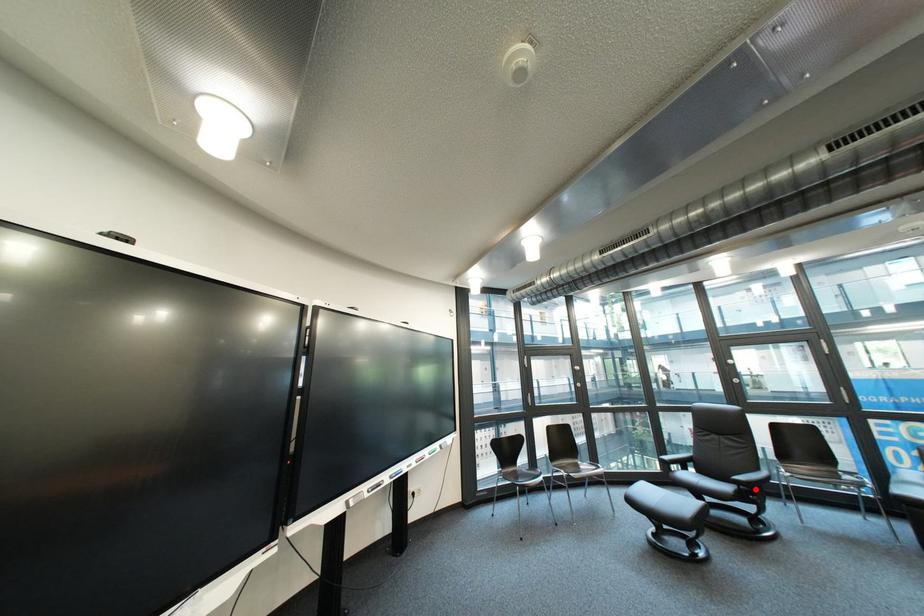
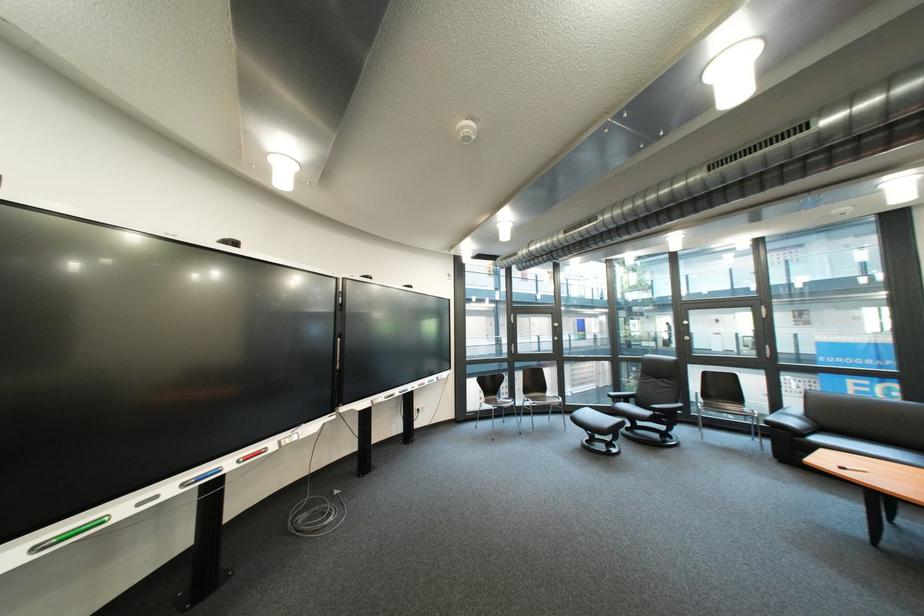
Where in the second image is the point corresponding to the highlighted location from the first image?

(670, 415)